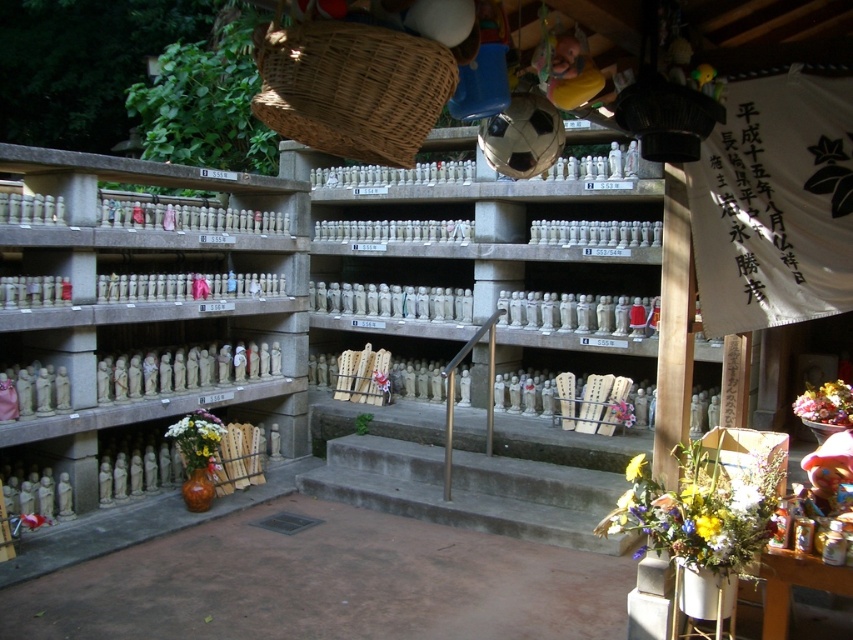
Question: Among these objects, which one is nearest to the camera?

Choices:
 (A) fluffy bouquet at lower right
 (B) yellow fabric flower at center
 (C) white floral bouquet at lower left
 (D) woven brown basket at upper center

Answer: (D)

Question: Is vibrant bouquet at lower right to the right of white floral bouquet at lower left from the viewer's perspective?

Choices:
 (A) yes
 (B) no

Answer: (A)

Question: Considering the relative positions of vibrant bouquet at lower right and yellow fabric flower at center in the image provided, where is vibrant bouquet at lower right located with respect to yellow fabric flower at center?

Choices:
 (A) right
 (B) left

Answer: (B)

Question: Is white floral bouquet at lower left wider than fluffy bouquet at lower right?

Choices:
 (A) no
 (B) yes

Answer: (B)

Question: Based on their relative distances, which object is nearer to the vibrant bouquet at lower right?

Choices:
 (A) woven brown basket at upper center
 (B) white floral bouquet at lower left

Answer: (A)

Question: Which point appears closest to the camera in this image?

Choices:
 (A) (202, 445)
 (B) (274, 92)
 (C) (608, 404)

Answer: (B)